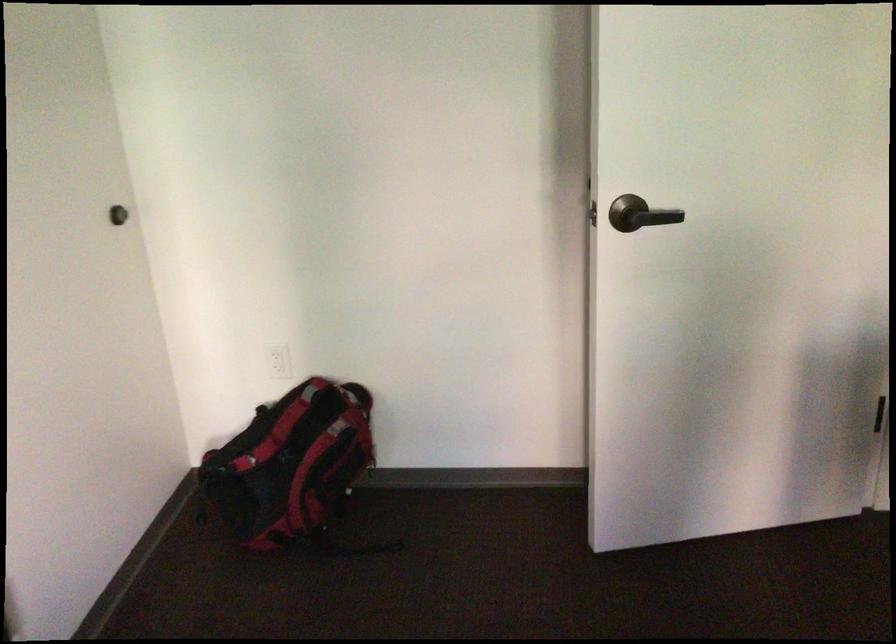
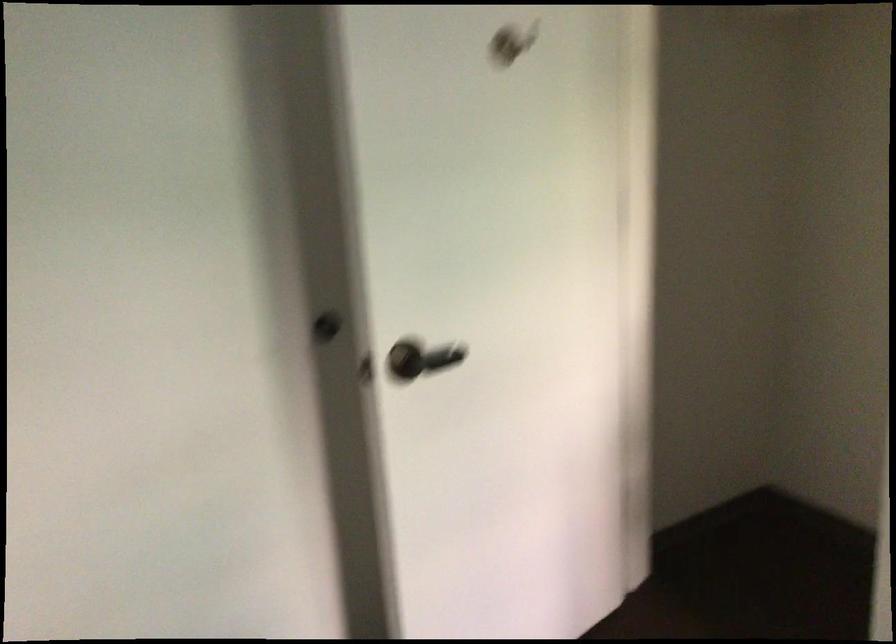
Question: Based on the continuous images, in which direction is the camera rotating? Reply with the corresponding letter.

Choices:
 (A) Left
 (B) Right
 (C) Up
 (D) Down

Answer: (B)